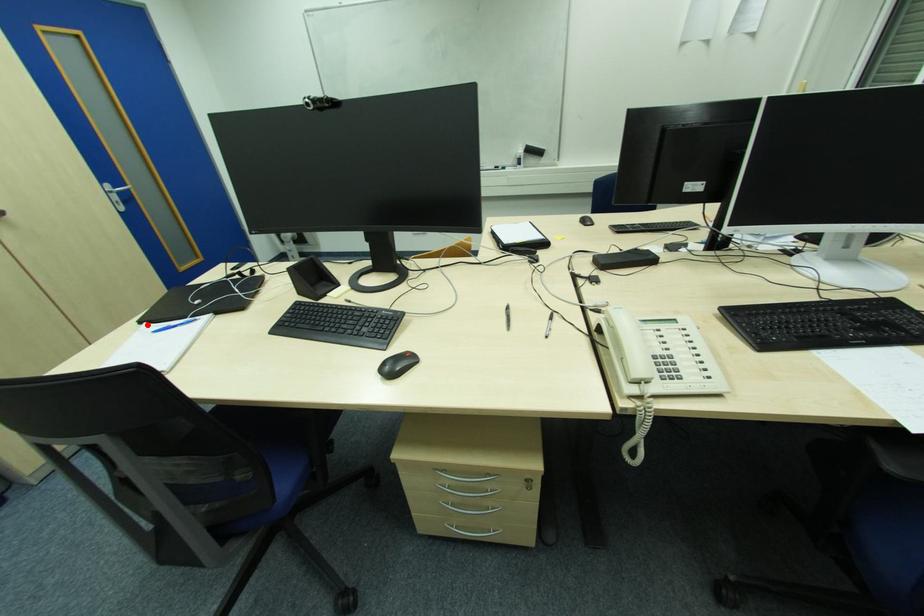
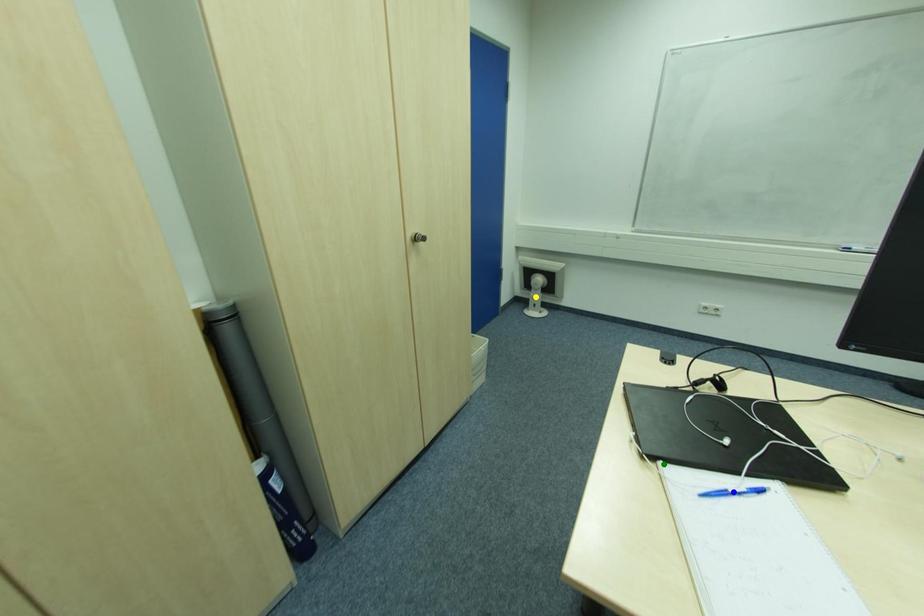
Question: I am providing you with two images of the same scene from different viewpoints. A red point is marked on the first image. You are given multiple points on the second image. Can you choose the point in image 2 that corresponds to the point in image 1?

Choices:
 (A) blue point
 (B) green point
 (C) yellow point

Answer: (B)